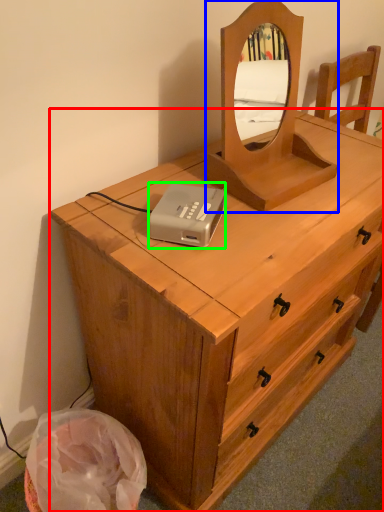
Question: Which object is positioned closest to chest of drawers (highlighted by a red box)? Select from mirror (highlighted by a blue box) and cassette (highlighted by a green box).

Choices:
 (A) mirror
 (B) cassette

Answer: (A)